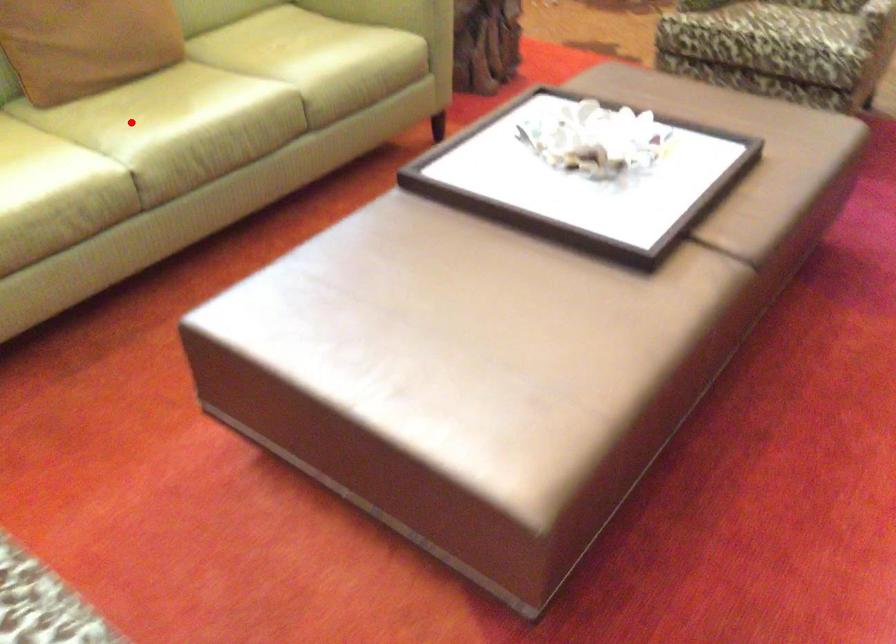
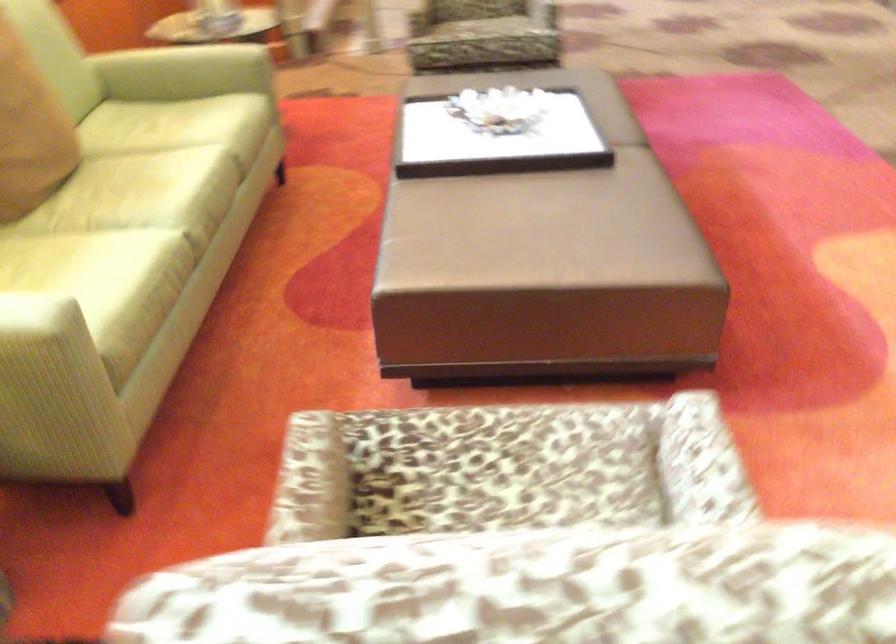
In the second image, find the point that corresponds to the highlighted location in the first image.

(136, 199)